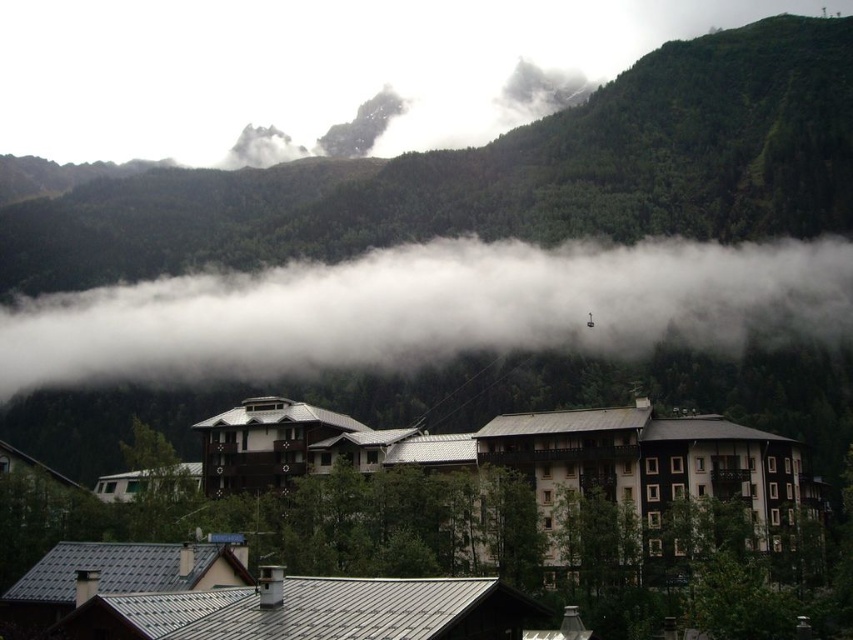
You are standing at the base of the mountain looking at the scene. There are two points marked in the image. The first point is at coordinates point (x=271, y=620) and the second is at point (x=44, y=324). Which point is closer to you?

Point (x=271, y=620) is in front of point (x=44, y=324), so it is closer to you.

You are a hiker who wants to take a photo of the brown wooden building at center and the white fluffy cloud at upper center. Which object will appear closer to the camera in your photo?

The brown wooden building at center will appear closer to the camera in your photo because it is in front of the white fluffy cloud at upper center.